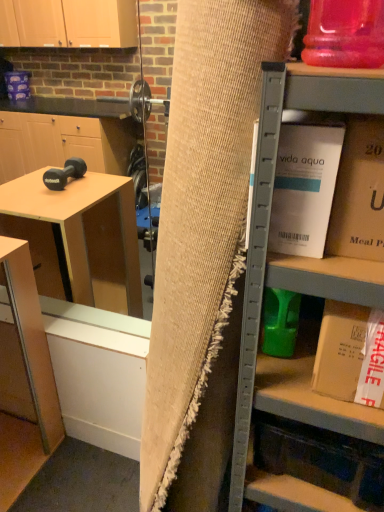
Question: In the image, is white cardboard box at upper right, the 2th book from the top, on the left side or the right side of burlap curtain at center?

Choices:
 (A) left
 (B) right

Answer: (B)

Question: Considering the positions of white cardboard box at upper right, which ranks as the 2th book in bottom-to-top order, and burlap curtain at center in the image, is white cardboard box at upper right, which ranks as the 2th book in bottom-to-top order, bigger or smaller than burlap curtain at center?

Choices:
 (A) small
 (B) big

Answer: (A)

Question: Which object is positioned closest to the white cardboard box at upper right, which ranks as the 2th book in bottom-to-top order?

Choices:
 (A) matte wood table at lower left
 (B) white cardboard box at right, the 3th book from the top
 (C) burlap curtain at center
 (D) gold cardboard box at upper right, the 1th book in the top-to-bottom sequence
 (E) white cardboard box at upper right

Answer: (D)

Question: Estimate the real-world distances between objects in this image. Which object is farther from the white cardboard box at upper right?

Choices:
 (A) white cardboard box at right, marked as the 1th book in a bottom-to-top arrangement
 (B) matte wood table at lower left
 (C) gold cardboard box at upper right, the 3th book from the bottom
 (D) burlap curtain at center
 (E) white cardboard box at upper right, the 2th book from the top

Answer: (B)